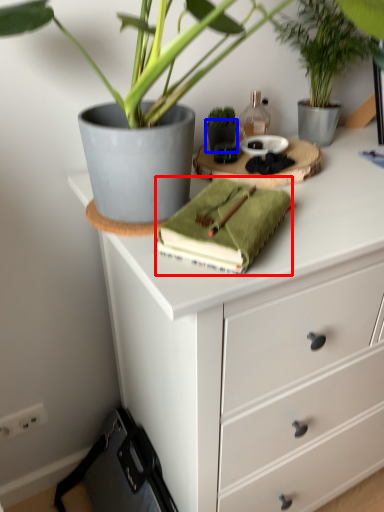
Question: Which object is further to the camera taking this photo, journal (highlighted by a red box) or flowerpot (highlighted by a blue box)?

Choices:
 (A) journal
 (B) flowerpot

Answer: (B)